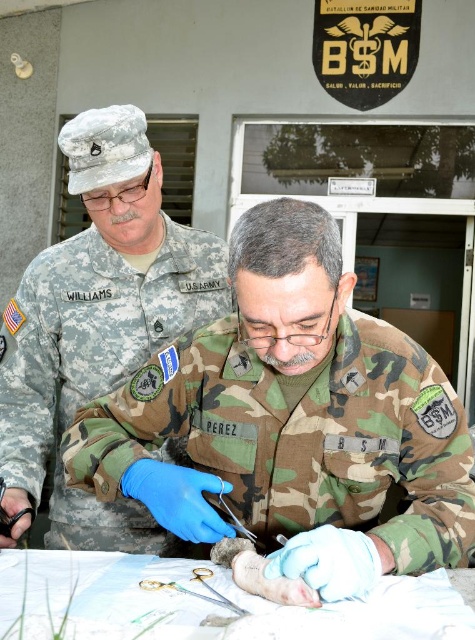
Question: Does camouflage fabric uniform at center have a larger size compared to camouflage uniform at center?

Choices:
 (A) yes
 (B) no

Answer: (B)

Question: Among these points, which one is farthest from the camera?

Choices:
 (A) (171, 428)
 (B) (161, 312)

Answer: (B)

Question: Is camouflage fabric uniform at center to the left of gold metallic scissors at center from the viewer's perspective?

Choices:
 (A) no
 (B) yes

Answer: (A)

Question: Does camouflage fabric uniform at center appear on the right side of camouflage uniform at center?

Choices:
 (A) yes
 (B) no

Answer: (A)

Question: Which object is farther from the camera taking this photo?

Choices:
 (A) gold metallic scissors at center
 (B) camouflage fabric uniform at center

Answer: (B)

Question: Considering the real-world distances, which object is closest to the gold metallic scissors at center?

Choices:
 (A) camouflage fabric uniform at center
 (B) camouflage uniform at center

Answer: (A)